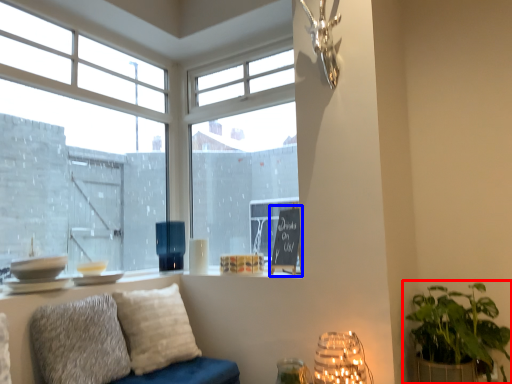
Question: Which point is closer to the camera, houseplant (highlighted by a red box) or bulletin board (highlighted by a blue box)?

Choices:
 (A) houseplant
 (B) bulletin board

Answer: (A)